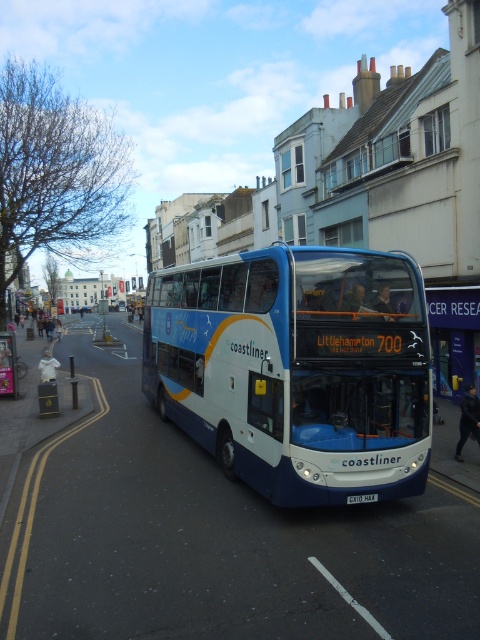
Consider the image. You are standing on the sidewalk and see two points marked on the bus. The first point is at coordinate point (168, 344) and the second is at point (371, 496). Which point is closer to you?

The point at (168, 344) is closer to you because it is further to the camera than the other point.

You are a delivery driver who needs to park your van near the blue metallic bus at center. The parking spot you found is located at coordinates 0.58, 0.62. Is this parking spot close enough to the bus to make your delivery?

The blue metallic bus at center is located at coordinates (297,369). The parking spot at (297,371) is very close, so yes, it is close enough to the bus for delivery purposes.

You are a pedestrian standing on the road and see the blue metallic bus at center and the white plastic license plate at center. Which one is more to the left?

The blue metallic bus at center is positioned on the left side of white plastic license plate at center, so the blue metallic bus at center is more to the left.